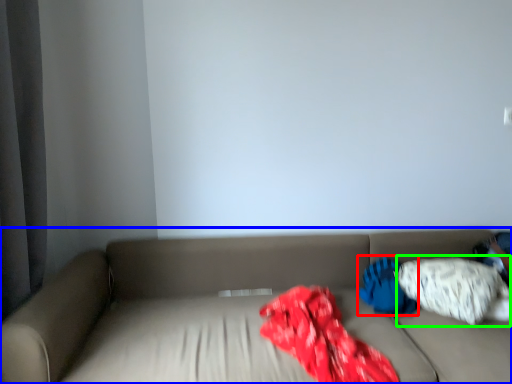
Question: Considering the real-world distances, which object is farthest from pillow (highlighted by a red box)? studio couch (highlighted by a blue box) or pillow (highlighted by a green box)?

Choices:
 (A) studio couch
 (B) pillow

Answer: (A)